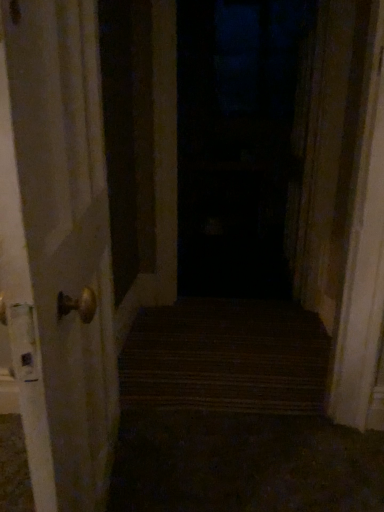
This screenshot has height=512, width=384. Describe the element at coordinates (56, 252) in the screenshot. I see `matte gold door handle at left` at that location.

What are the coordinates of `matte gold door handle at left` in the screenshot? It's located at pos(56,252).

This screenshot has height=512, width=384. In order to click on transparent glass door at center in this screenshot , I will do `click(236, 142)`.

Image resolution: width=384 pixels, height=512 pixels. What do you see at coordinates (236, 142) in the screenshot?
I see `transparent glass door at center` at bounding box center [236, 142].

Measure the distance between transparent glass door at center and camera.

transparent glass door at center and camera are 2.71 meters apart.

The width and height of the screenshot is (384, 512). I want to click on matte gold door handle at left, so click(56, 252).

Can you confirm if matte gold door handle at left is positioned to the left of transparent glass door at center?

Yes, matte gold door handle at left is to the left of transparent glass door at center.

Is the position of matte gold door handle at left less distant than that of transparent glass door at center?

Yes, matte gold door handle at left is closer to the viewer.

Which is behind, point (64, 274) or point (271, 125)?

The point (271, 125) is more distant.

From the picture: From the image's perspective, is matte gold door handle at left under transparent glass door at center?

Yes, from the image's perspective, matte gold door handle at left is below transparent glass door at center.

From a real-world perspective, does matte gold door handle at left sit lower than transparent glass door at center?

Yes, from a real-world perspective, matte gold door handle at left is beneath transparent glass door at center.

Considering the relative sizes of matte gold door handle at left and transparent glass door at center in the image provided, is matte gold door handle at left thinner than transparent glass door at center?

Correct, the width of matte gold door handle at left is less than that of transparent glass door at center.

Does matte gold door handle at left have a lesser height compared to transparent glass door at center?

Yes, matte gold door handle at left is shorter than transparent glass door at center.

Considering the sizes of objects matte gold door handle at left and transparent glass door at center in the image provided, who is bigger, matte gold door handle at left or transparent glass door at center?

With larger size is transparent glass door at center.

Is matte gold door handle at left inside the boundaries of transparent glass door at center, or outside?

matte gold door handle at left lies outside transparent glass door at center.

Is matte gold door handle at left not close to transparent glass door at center?

Yes, matte gold door handle at left and transparent glass door at center are quite far apart.

From the picture: Does matte gold door handle at left turn towards transparent glass door at center?

No, matte gold door handle at left is not turned towards transparent glass door at center.

I want to click on window on the right of matte gold door handle at left, so click(236, 142).

Considering the positions of objects transparent glass door at center and matte gold door handle at left in the image provided, who is more to the right, transparent glass door at center or matte gold door handle at left?

transparent glass door at center is more to the right.

Which object is closer to the camera taking this photo, transparent glass door at center or matte gold door handle at left?

matte gold door handle at left is in front.

Is point (179, 143) positioned in front of point (31, 123)?

No, (179, 143) is behind (31, 123).

From the image's perspective, is transparent glass door at center beneath matte gold door handle at left?

Result: No, from the image's perspective, transparent glass door at center is not beneath matte gold door handle at left.

From a real-world perspective, is transparent glass door at center over matte gold door handle at left?

Yes.

Does transparent glass door at center have a greater width compared to matte gold door handle at left?

Yes, transparent glass door at center is wider than matte gold door handle at left.

Considering the sizes of transparent glass door at center and matte gold door handle at left in the image, is transparent glass door at center taller or shorter than matte gold door handle at left?

transparent glass door at center is taller than matte gold door handle at left.

Considering the sizes of objects transparent glass door at center and matte gold door handle at left in the image provided, who is smaller, transparent glass door at center or matte gold door handle at left?

With smaller size is matte gold door handle at left.

Is transparent glass door at center inside or outside of matte gold door handle at left?

transparent glass door at center is spatially situated outside matte gold door handle at left.

Can you see transparent glass door at center touching matte gold door handle at left?

No, transparent glass door at center is not with matte gold door handle at left.

Could you tell me if transparent glass door at center is turned towards matte gold door handle at left?

Yes, transparent glass door at center is facing matte gold door handle at left.

Can you tell me how much transparent glass door at center and matte gold door handle at left differ in facing direction?

98.3 degrees.

Where is `window above the matte gold door handle at left (from the image's perspective)`? Image resolution: width=384 pixels, height=512 pixels. window above the matte gold door handle at left (from the image's perspective) is located at coordinates (236, 142).

Image resolution: width=384 pixels, height=512 pixels. I want to click on window behind the matte gold door handle at left, so click(236, 142).

The height and width of the screenshot is (512, 384). What are the coordinates of `door on the left of transparent glass door at center` in the screenshot? It's located at (56, 252).